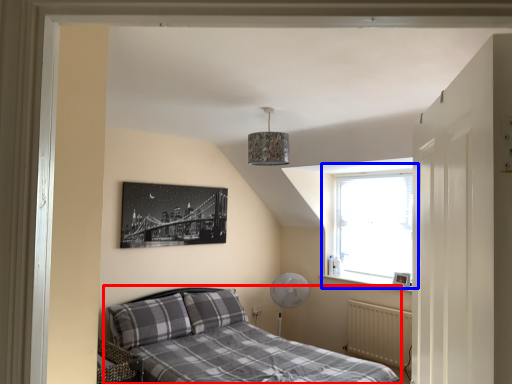
Question: Which of the following is the closest to the observer, bed (highlighted by a red box) or window (highlighted by a blue box)?

Choices:
 (A) bed
 (B) window

Answer: (A)